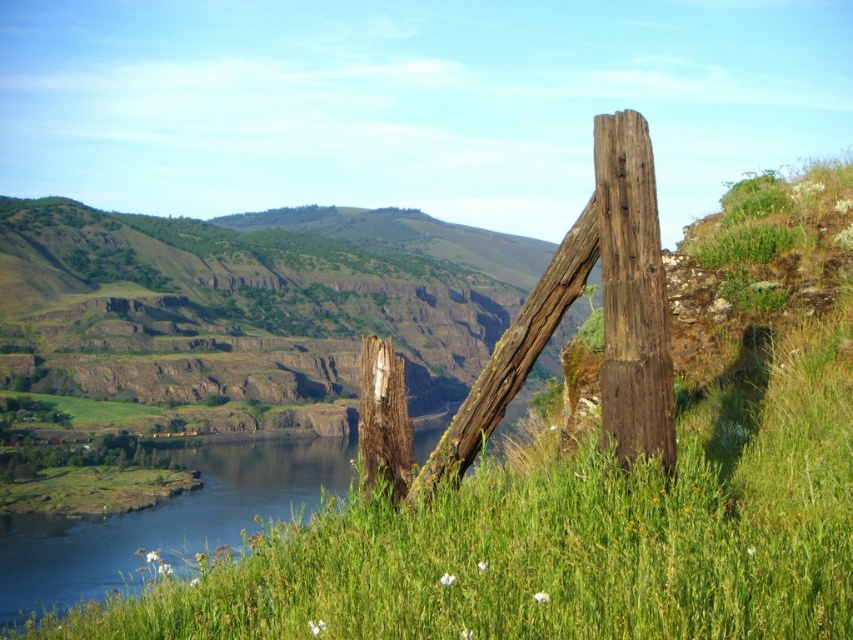
Question: Which point appears farthest from the camera in this image?

Choices:
 (A) (250, 252)
 (B) (607, 192)

Answer: (A)

Question: Where is green grassy hillside at left located in relation to weathered brown wood post at right in the image?

Choices:
 (A) right
 (B) left

Answer: (B)

Question: Is green grassy hillside at left wider than weathered brown wood post at right?

Choices:
 (A) no
 (B) yes

Answer: (B)

Question: Among these points, which one is farthest from the camera?

Choices:
 (A) (39, 392)
 (B) (613, 317)

Answer: (A)

Question: Does green grassy hillside at left have a smaller size compared to weathered brown wood post at right?

Choices:
 (A) no
 (B) yes

Answer: (A)